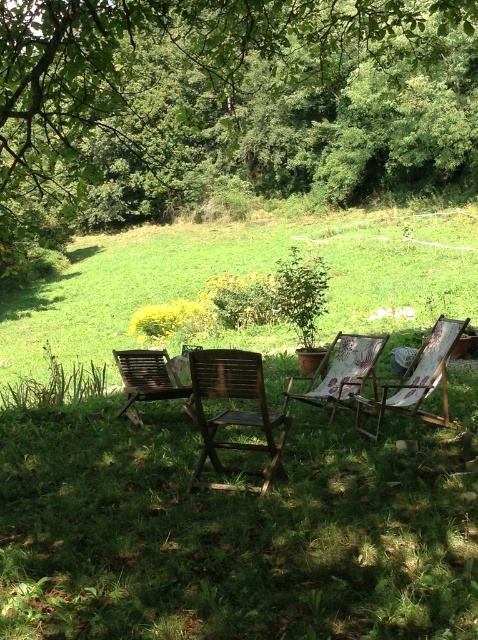
You are planning to set up a picnic and need to know if there is enough space between the green grassy at lower center and the wooden slatted chair at left for a picnic blanket. Can you determine if the space is sufficient?

The green grassy at lower center is larger in size than the wooden slatted chair at left, so there should be enough space between them for a picnic blanket.

You are standing at the center of the image and want to move towards the wooden deck chair at right. Which direction should you move to reach it?

The wooden deck chair at right is located at point (419, 378) in the image. Since you are at the center, you should move towards the right and slightly upwards to reach it.